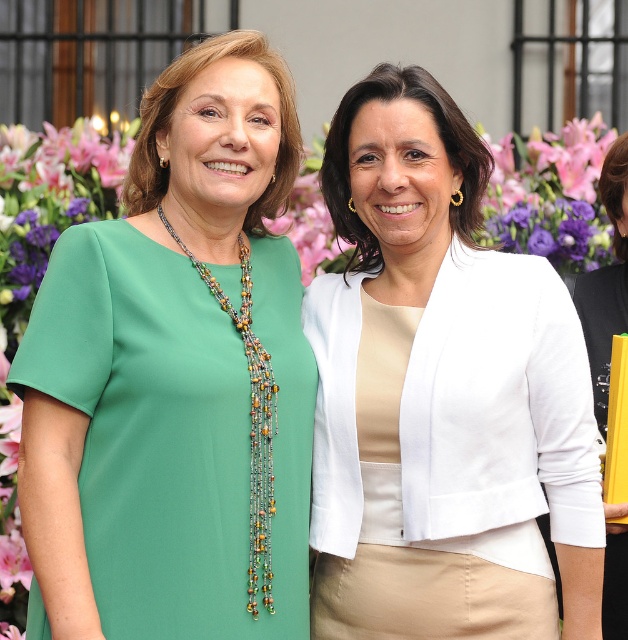
You are a photographer at a formal event. You notice two white garments at the center of your frame. The first is a white matte blazer at center, and the second is a white fabric dress at center. Based on their positions, which garment is closer to you?

The white matte blazer at center is closer to you because it is in front of the white fabric dress at center.

Looking at the two women in the image, which object is positioned to the left of the multicolored beaded necklace at center? The options are the green satin dress at left and the white cropped blazer on the right.

The green satin dress at left is positioned to the left of the multicolored beaded necklace at center.